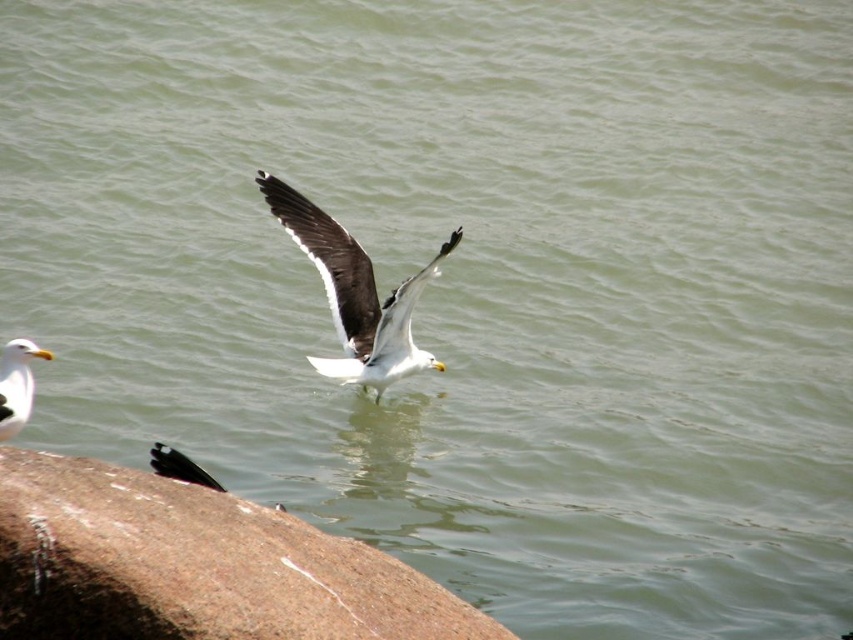
At what (x,y) coordinates should I click in order to perform the action: click on brown granite rock at lower left. Please return your answer as a coordinate pair (x, y). Looking at the image, I should click on (193, 564).

Does brown granite rock at lower left appear on the left side of white matte seagull at center?

Indeed, brown granite rock at lower left is positioned on the left side of white matte seagull at center.

You are a GUI agent. You are given a task and a screenshot of the screen. Output one action in this format:
    pyautogui.click(x=<x>, y=<y>)
    Task: Click on the brown granite rock at lower left
    
    Given the screenshot: What is the action you would take?
    click(193, 564)

The height and width of the screenshot is (640, 853). I want to click on brown granite rock at lower left, so click(x=193, y=564).

Can you confirm if brown granite rock at lower left is positioned to the left of white matte seagull at lower left?

Incorrect, brown granite rock at lower left is not on the left side of white matte seagull at lower left.

Does point (279, 541) lie in front of point (3, 388)?

Yes, point (279, 541) is in front of point (3, 388).

Image resolution: width=853 pixels, height=640 pixels. Describe the element at coordinates (193, 564) in the screenshot. I see `brown granite rock at lower left` at that location.

The width and height of the screenshot is (853, 640). I want to click on brown granite rock at lower left, so click(193, 564).

Which of these two, white matte seagull at center or white matte seagull at lower left, stands taller?

Standing taller between the two is white matte seagull at center.

Is white matte seagull at center to the left of white matte seagull at lower left from the viewer's perspective?

Incorrect, white matte seagull at center is not on the left side of white matte seagull at lower left.

What do you see at coordinates (355, 292) in the screenshot? The height and width of the screenshot is (640, 853). I see `white matte seagull at center` at bounding box center [355, 292].

Locate an element on the screen. The width and height of the screenshot is (853, 640). white matte seagull at center is located at coordinates (355, 292).